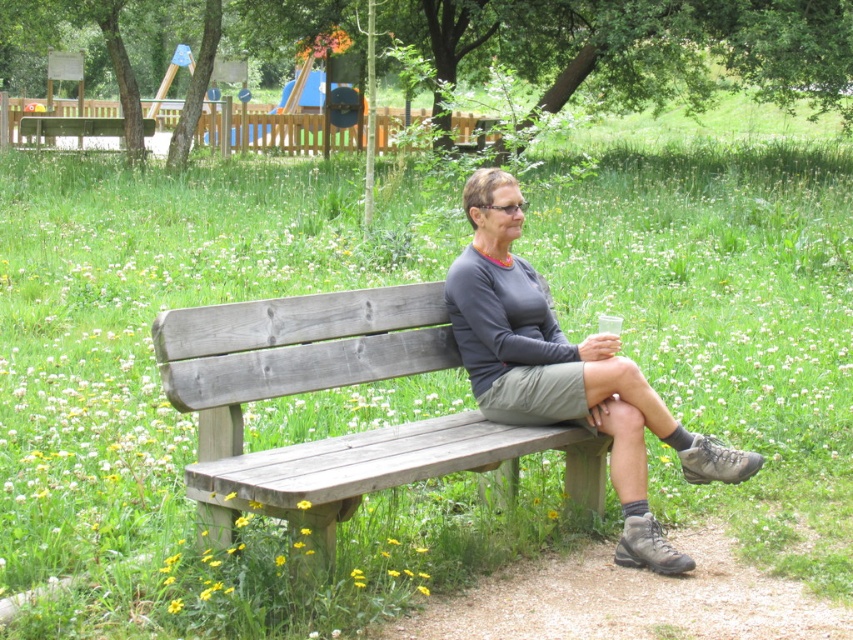
Is point (258, 484) closer to camera compared to point (506, 189)?

Yes, point (258, 484) is closer to viewer.

Can you confirm if gray wooden bench at center is positioned to the left of matte gray shirt at center?

Indeed, gray wooden bench at center is positioned on the left side of matte gray shirt at center.

Which is in front, point (358, 326) or point (450, 314)?

Point (358, 326) is in front.

I want to click on gray wooden bench at center, so click(x=329, y=387).

In the scene shown: Does matte gray shirt at center have a lesser height compared to wooden bench at center?

No.

Between matte gray shirt at center and wooden bench at center, which one has less height?

Standing shorter between the two is wooden bench at center.

Is point (555, 353) positioned after point (78, 125)?

No, it is in front of (78, 125).

The width and height of the screenshot is (853, 640). Identify the location of matte gray shirt at center. (566, 371).

Who is more forward, (303, 515) or (28, 120)?

Point (303, 515)

Who is positioned more to the left, gray wooden bench at center or wooden bench at center?

wooden bench at center

Locate an element on the screen. This screenshot has width=853, height=640. gray wooden bench at center is located at coordinates (329, 387).

Where is `gray wooden bench at center`? The height and width of the screenshot is (640, 853). gray wooden bench at center is located at coordinates (329, 387).